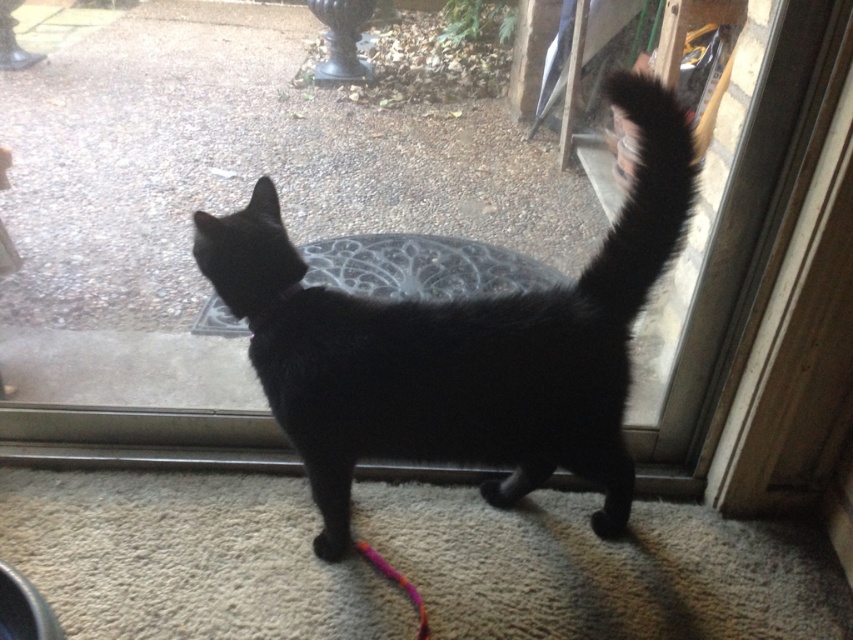
Can you confirm if transparent glass window at center is thinner than black fluffy tail at upper right?

In fact, transparent glass window at center might be wider than black fluffy tail at upper right.

Which of these two, transparent glass window at center or black fluffy tail at upper right, stands shorter?

black fluffy tail at upper right is shorter.

Does point (492, 150) come farther from viewer compared to point (645, 124)?

Yes, point (492, 150) is behind point (645, 124).

You are a GUI agent. You are given a task and a screenshot of the screen. Output one action in this format:
    pyautogui.click(x=<x>, y=<y>)
    Task: Click on the transparent glass window at center
    This screenshot has height=640, width=853.
    Given the screenshot: What is the action you would take?
    pyautogui.click(x=218, y=212)

Which of these two, black fur cat at center or black fluffy tail at upper right, stands taller?

Standing taller between the two is black fur cat at center.

Is point (440, 401) in front of point (654, 236)?

No, it is behind (654, 236).

This screenshot has height=640, width=853. In order to click on black fur cat at center in this screenshot , I will do `click(459, 346)`.

Does transparent glass window at center have a greater height compared to black fur cat at center?

Indeed, transparent glass window at center has a greater height compared to black fur cat at center.

Is transparent glass window at center shorter than black fur cat at center?

Incorrect, transparent glass window at center's height does not fall short of black fur cat at center's.

Does point (202, 99) come closer to viewer compared to point (556, 440)?

No, (202, 99) is further to viewer.

Where is `transparent glass window at center`? This screenshot has width=853, height=640. transparent glass window at center is located at coordinates (218, 212).